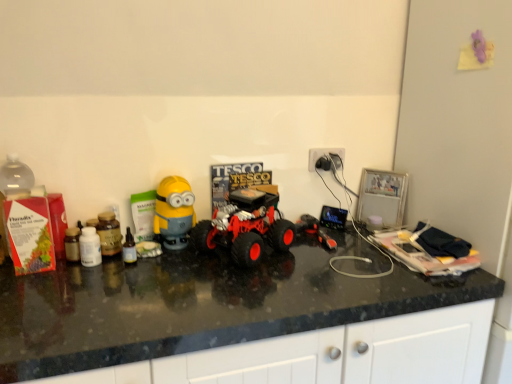
Locate an element on the screen. space that is in front of translucent glass bottle at center is located at coordinates (115, 288).